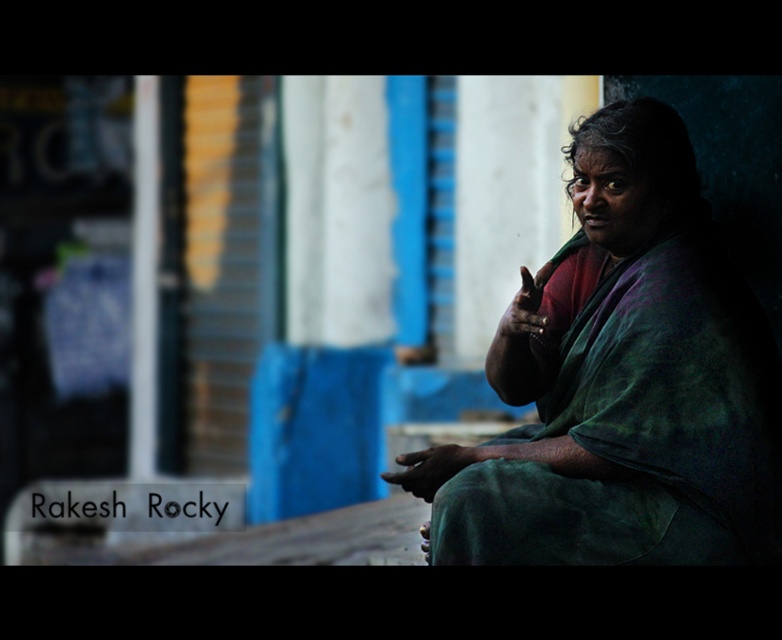
Question: Does green fabric at center appear on the left side of matte green hand at center-right?

Choices:
 (A) yes
 (B) no

Answer: (B)

Question: Estimate the real-world distances between objects in this image. Which object is closer to the green fabric at center?

Choices:
 (A) matte green hand at center-right
 (B) dark green fabric hand at lower center

Answer: (A)

Question: Does green fabric at center have a smaller size compared to dark green fabric hand at lower center?

Choices:
 (A) yes
 (B) no

Answer: (B)

Question: Estimate the real-world distances between objects in this image. Which object is closer to the matte green hand at center-right?

Choices:
 (A) green fabric at center
 (B) dark green fabric hand at lower center

Answer: (A)

Question: Is dark green fabric hand at lower center above matte green hand at center-right?

Choices:
 (A) yes
 (B) no

Answer: (B)

Question: Estimate the real-world distances between objects in this image. Which object is closer to the dark green fabric hand at lower center?

Choices:
 (A) green fabric at center
 (B) matte green hand at center-right

Answer: (B)